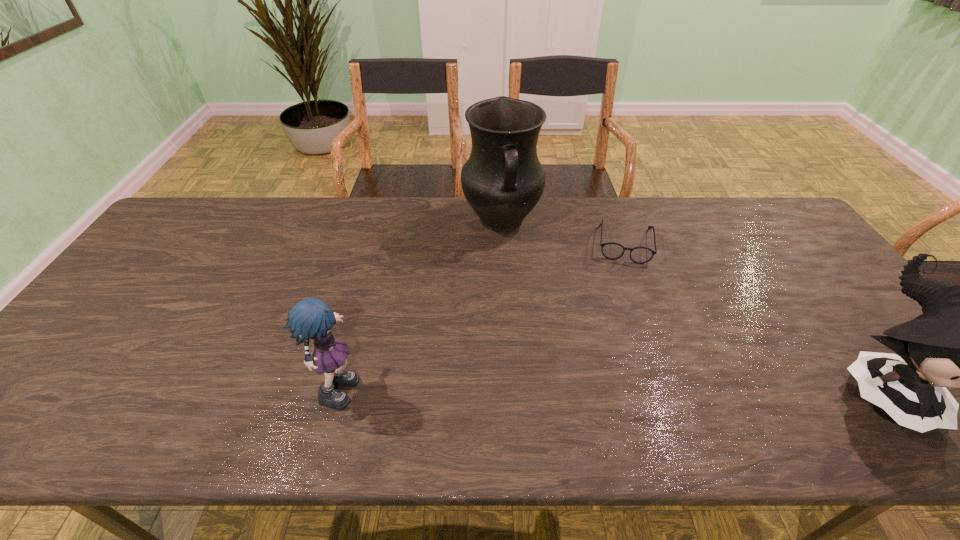
Identify the location of vacant space on the desktop that is between the rag doll and the rightmost object and is positioned on the front-facing side of the shortest object. (622, 384).

Find the location of a particular element. The image size is (960, 540). vacant space on the desktop that is between the leftmost object and the doll and is positioned on the handle side of the second object from left to right is located at coordinates (537, 384).